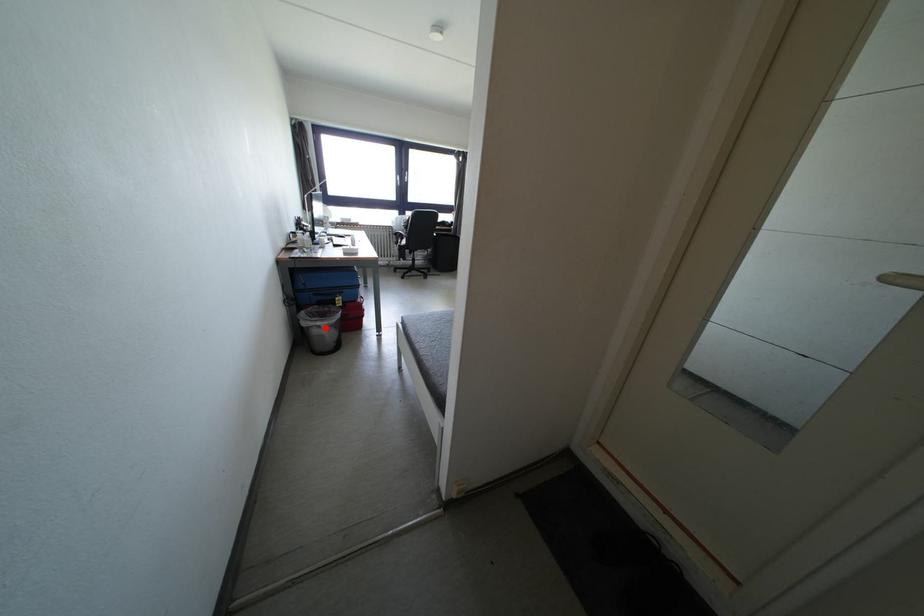
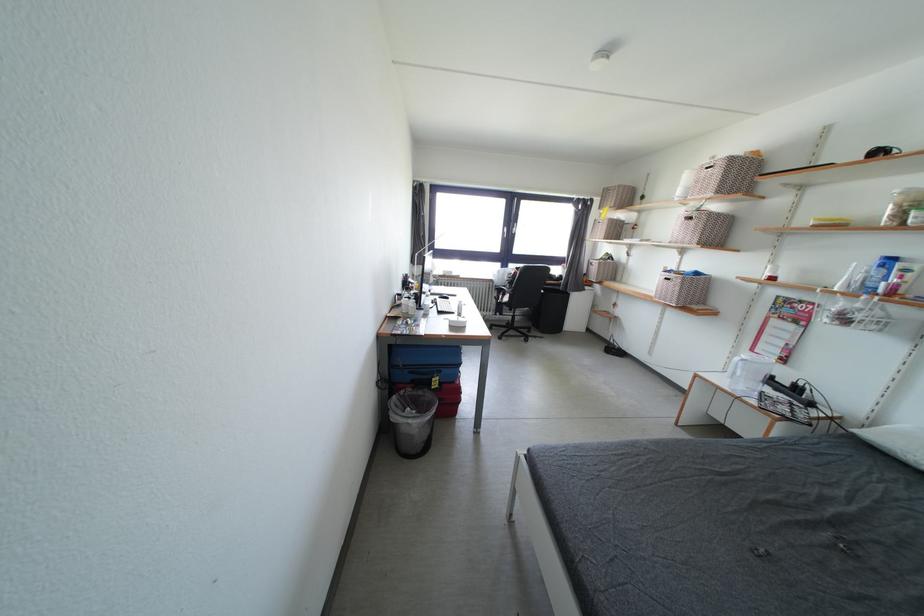
Question: I am providing you with two images of the same scene from different viewpoints. Given a red point in image1, look at the same physical point in image2. Is it:

Choices:
 (A) Closer to the viewpoint
 (B) Farther from the viewpoint

Answer: (B)